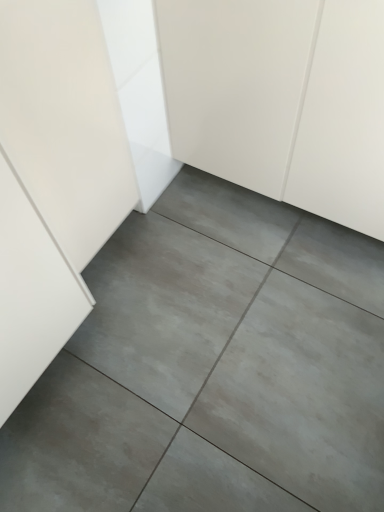
Locate an element on the screen. The image size is (384, 512). free point above gray concrete floor at center (from a real-world perspective) is located at coordinates (209, 359).